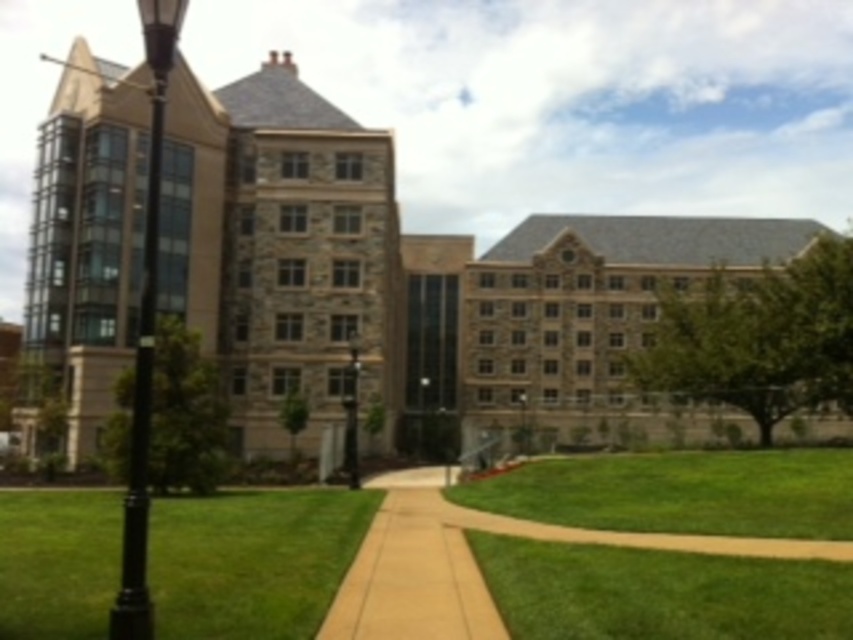
You are a gardener who needs to mow the lawn. You see the green grass at lower left and the black metal lamp post at center. Which area requires more time to mow, and why?

The green grass at lower left requires more time to mow because it is bigger than the black metal lamp post at center.

You are standing at the entrance of the campus and want to walk towards the building. There is green grass at lower left and a black polished metal lamp post at left. Which direction should you go if you want to stay on the path that is wider?

The green grass at lower left is wider than the black polished metal lamp post at left, so you should go towards the green grass at lower left to stay on the wider path.